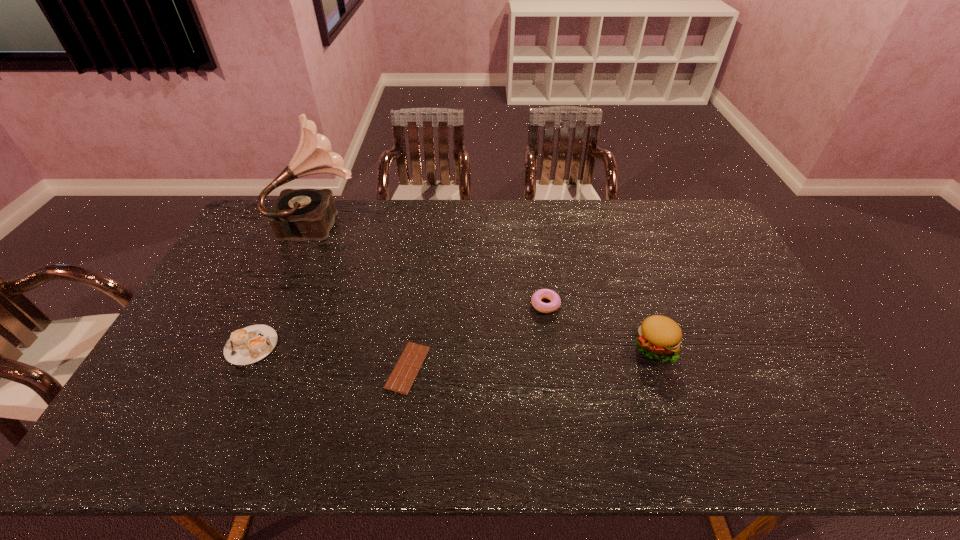
You are a GUI agent. You are given a task and a screenshot of the screen. Output one action in this format:
    pyautogui.click(x=<x>, y=<y>)
    Task: Click on the free region at the left edge of the desktop
    
    Given the screenshot: What is the action you would take?
    pyautogui.click(x=201, y=335)

In the image, there is a desktop. Identify the location of vacant space at the right edge. (x=799, y=373).

At what (x,y) coordinates should I click in order to perform the action: click on free space at the near left corner of the desktop. Please return your answer as a coordinate pair (x, y). The width and height of the screenshot is (960, 540). Looking at the image, I should click on (x=128, y=430).

This screenshot has width=960, height=540. In the image, there is a desktop. Find the location of `free space at the near right corner`. free space at the near right corner is located at coordinates (838, 453).

This screenshot has width=960, height=540. Identify the location of free spot between the shortest object and the cappuccino. (329, 356).

Find the location of `free space between the cappuccino and the chocolate bar`. free space between the cappuccino and the chocolate bar is located at coordinates (329, 356).

Locate an element on the screen. The image size is (960, 540). unoccupied area between the tallest object and the chocolate bar is located at coordinates (365, 295).

Locate an element on the screen. The image size is (960, 540). unoccupied position between the tallest object and the third object from right to left is located at coordinates (365, 295).

Image resolution: width=960 pixels, height=540 pixels. I want to click on vacant region between the farthest object and the cappuccino, so pyautogui.click(x=287, y=284).

Find the location of `vacant space that's between the cappuccino and the shortest object`. vacant space that's between the cappuccino and the shortest object is located at coordinates (329, 356).